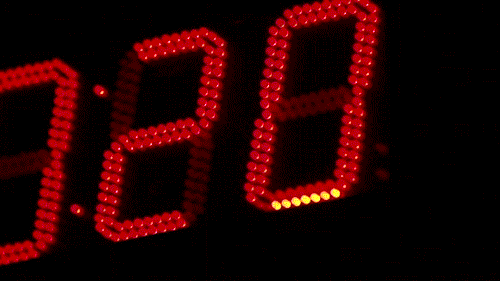
Locate an element on the screen. This screenshot has width=500, height=281. word "escape" written in blue on whiteboard is located at coordinates (139, 47).